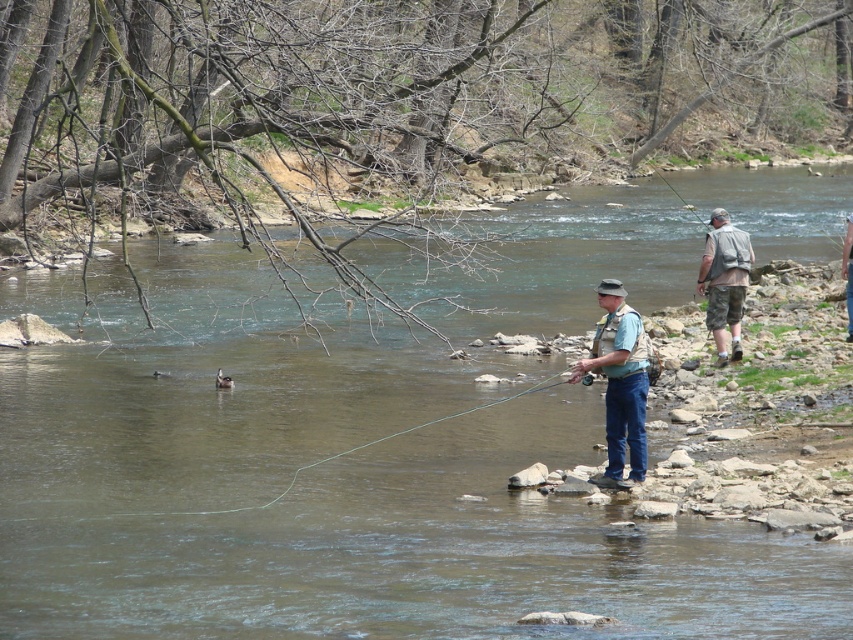
You are standing at the edge of the river and notice the light blue fabric shirt at center. Based on its position, can you estimate how far it is from the water surface?

The light blue fabric shirt at center is located at point (619,381), which means it is approximately 0.7 meters away from the water surface.